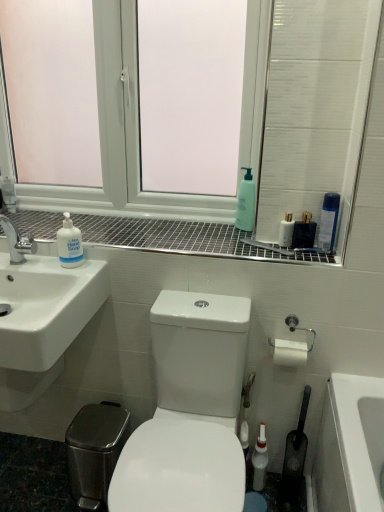
The height and width of the screenshot is (512, 384). I want to click on vacant space in front of white glossy mouthwash at upper right, positioned as the 2th mouthwash in bottom-to-top order, so click(290, 259).